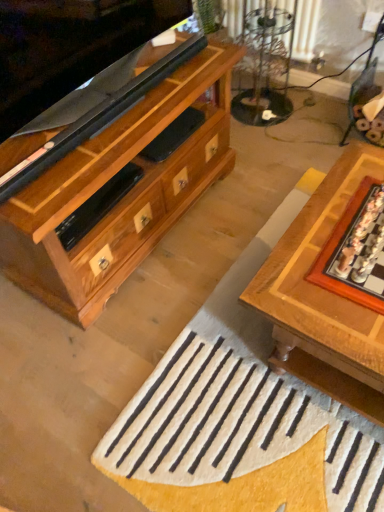
This screenshot has width=384, height=512. Find the location of `vacant region below clear glass table at upper center (from a real-world perspective)`. vacant region below clear glass table at upper center (from a real-world perspective) is located at coordinates (269, 118).